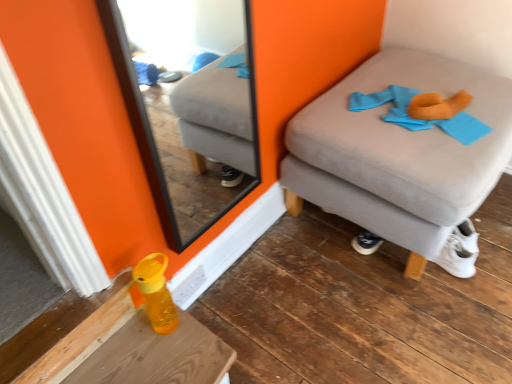
Locate an element on the screen. The image size is (512, 384). vacant region to the left of translucent yellow bottle at lower left is located at coordinates (125, 345).